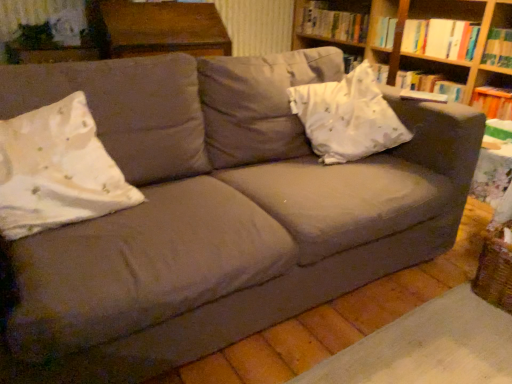
Question: Does wooden bookshelf at upper right have a smaller size compared to hardcover book at right?

Choices:
 (A) no
 (B) yes

Answer: (A)

Question: Is wooden bookshelf at upper right positioned behind hardcover book at right?

Choices:
 (A) no
 (B) yes

Answer: (A)

Question: Is wooden bookshelf at upper right far away from hardcover book at right?

Choices:
 (A) yes
 (B) no

Answer: (B)

Question: Does wooden bookshelf at upper right touch hardcover book at right?

Choices:
 (A) yes
 (B) no

Answer: (B)

Question: Is wooden bookshelf at upper right at the left side of hardcover book at right?

Choices:
 (A) no
 (B) yes

Answer: (B)

Question: In terms of height, does wooden bookshelf at upper right look taller or shorter compared to hardcover book at upper right, which ranks as the 1th book in back-to-front order?

Choices:
 (A) short
 (B) tall

Answer: (B)

Question: From the image's perspective, is wooden bookshelf at upper right above or below hardcover book at upper right, which ranks as the 1th book in back-to-front order?

Choices:
 (A) above
 (B) below

Answer: (B)

Question: Visually, is wooden bookshelf at upper right positioned to the left or to the right of hardcover book at upper right, which ranks as the 1th book in back-to-front order?

Choices:
 (A) left
 (B) right

Answer: (B)

Question: Is wooden bookshelf at upper right in front of or behind hardcover book at upper right, which ranks as the second book in front-to-back order, in the image?

Choices:
 (A) behind
 (B) front

Answer: (B)

Question: In terms of size, does hardcover book at right appear bigger or smaller than hardcover book at upper right, which ranks as the 1th book in back-to-front order?

Choices:
 (A) big
 (B) small

Answer: (B)

Question: From the image's perspective, is hardcover book at right located above or below hardcover book at upper right, which ranks as the 1th book in back-to-front order?

Choices:
 (A) above
 (B) below

Answer: (B)

Question: Which is correct: hardcover book at right is inside hardcover book at upper right, which ranks as the second book in front-to-back order, or outside of it?

Choices:
 (A) outside
 (B) inside

Answer: (A)

Question: Relative to hardcover book at upper right, which ranks as the 1th book in back-to-front order, is hardcover book at right in front or behind?

Choices:
 (A) front
 (B) behind

Answer: (A)

Question: Looking at the image, does hardcover book at right seem bigger or smaller compared to white floral fabric pillow at left, the 2th throw pillow viewed from the right?

Choices:
 (A) small
 (B) big

Answer: (A)

Question: From a real-world perspective, is hardcover book at right above or below white floral fabric pillow at left, which is the first throw pillow from front to back?

Choices:
 (A) below
 (B) above

Answer: (A)